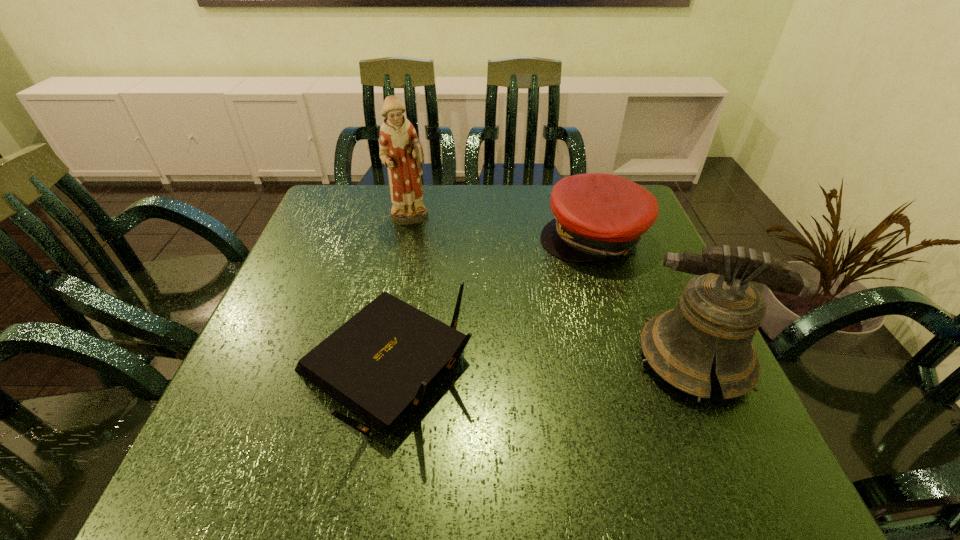
The width and height of the screenshot is (960, 540). Find the location of `router`. router is located at coordinates (380, 360).

Locate an element on the screen. The width and height of the screenshot is (960, 540). bell is located at coordinates pos(719,312).

Where is `cap`? cap is located at coordinates pos(596,215).

You are a GUI agent. You are given a task and a screenshot of the screen. Output one action in this format:
    pyautogui.click(x=<x>, y=<y>)
    Task: Click on the tallest object
    
    Given the screenshot: What is the action you would take?
    pyautogui.click(x=401, y=152)

Find the location of a particular element. Image resolution: width=960 pixels, height=540 pixels. vacant space situated on the back of the router is located at coordinates click(x=409, y=241).

Identify the location of vacant area situated 0.060m on the back of the bell. (667, 298).

Identify the location of vacant space located 0.400m on the front-facing side of the cap. The width and height of the screenshot is (960, 540). (519, 400).

At what (x,y) coordinates should I click in order to perform the action: click on vacant space located on the front-facing side of the cap. Please return your answer as a coordinate pair (x, y). This screenshot has height=540, width=960. Looking at the image, I should click on [x=527, y=383].

Identify the location of free space located 0.050m on the front-facing side of the cap. (573, 280).

Locate an element on the screen. This screenshot has height=540, width=960. vacant space situated 0.340m on the front-facing side of the tallest object is located at coordinates (467, 314).